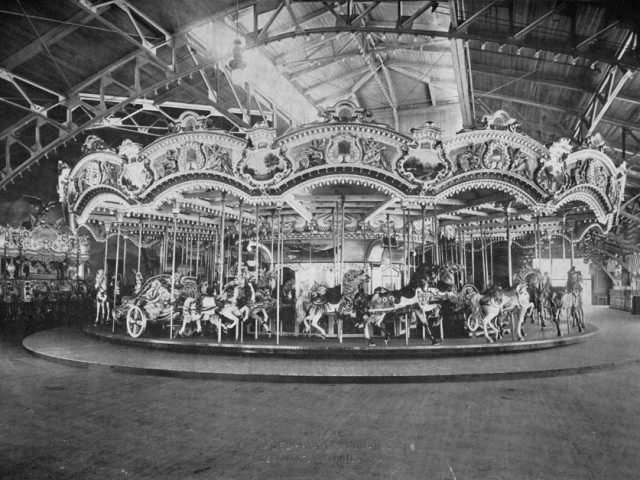
Locate an element on the screen. beams is located at coordinates (102, 73), (128, 98), (51, 29), (541, 102), (563, 89).